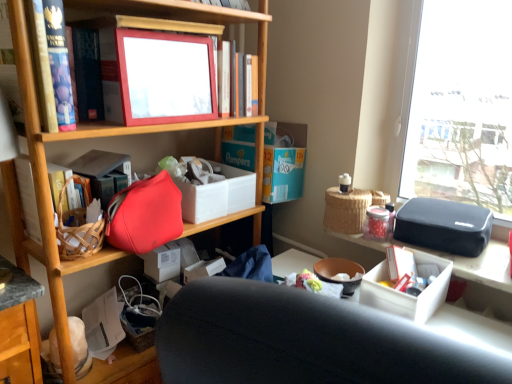
Question: Are matte plastic picture frame at upper center and matte plastic picture frame at upper center, placed as the first book when sorted from top to bottom, located far from each other?

Choices:
 (A) yes
 (B) no

Answer: (B)

Question: Is matte plastic picture frame at upper center outside of matte plastic picture frame at upper center, placed as the first book when sorted from top to bottom?

Choices:
 (A) no
 (B) yes

Answer: (B)

Question: From a real-world perspective, is matte plastic picture frame at upper center physically below matte plastic picture frame at upper center, marked as the 1th book in a right-to-left arrangement?

Choices:
 (A) yes
 (B) no

Answer: (B)

Question: From the image's perspective, is matte plastic picture frame at upper center under matte plastic picture frame at upper center, positioned as the second book in bottom-to-top order?

Choices:
 (A) no
 (B) yes

Answer: (B)

Question: Is the position of matte plastic picture frame at upper center more distant than that of matte plastic picture frame at upper center, positioned as the second book in bottom-to-top order?

Choices:
 (A) no
 (B) yes

Answer: (A)

Question: From a real-world perspective, relative to matte red book at left, which is the second book from top to bottom, is matte plastic picture frame at upper center vertically above or below?

Choices:
 (A) below
 (B) above

Answer: (B)

Question: Is matte plastic picture frame at upper center to the left or to the right of matte red book at left, marked as the first book in a bottom-to-top arrangement, in the image?

Choices:
 (A) right
 (B) left

Answer: (A)

Question: Is matte plastic picture frame at upper center in front of or behind matte red book at left, the first book when ordered from left to right, in the image?

Choices:
 (A) behind
 (B) front

Answer: (B)

Question: Considering the positions of matte plastic picture frame at upper center and matte red book at left, which is the second book from top to bottom, in the image, is matte plastic picture frame at upper center bigger or smaller than matte red book at left, which is the second book from top to bottom,?

Choices:
 (A) small
 (B) big

Answer: (A)

Question: Is woven picnic basket at upper right bigger or smaller than matte red handbag at center-left?

Choices:
 (A) big
 (B) small

Answer: (B)

Question: Visually, is woven picnic basket at upper right positioned to the left or to the right of matte red handbag at center-left?

Choices:
 (A) left
 (B) right

Answer: (B)

Question: From the image's perspective, is woven picnic basket at upper right positioned above or below matte red handbag at center-left?

Choices:
 (A) below
 (B) above

Answer: (B)

Question: From a real-world perspective, is woven picnic basket at upper right above or below matte red handbag at center-left?

Choices:
 (A) above
 (B) below

Answer: (B)

Question: Looking at their shapes, would you say matte red handbag at center-left is wider or thinner than matte plastic picture frame at upper center, placed as the first book when sorted from top to bottom?

Choices:
 (A) wide
 (B) thin

Answer: (A)

Question: Based on their sizes in the image, would you say matte red handbag at center-left is bigger or smaller than matte plastic picture frame at upper center, which is the second book from left to right?

Choices:
 (A) small
 (B) big

Answer: (B)